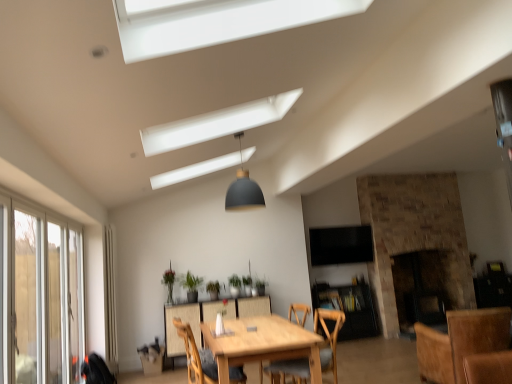
Question: From the image's perspective, is light brown wooden table at center positioned above or below green matte plant at center, placed as the third plant when sorted from right to left?

Choices:
 (A) below
 (B) above

Answer: (A)

Question: In terms of height, does light brown wooden table at center look taller or shorter compared to green matte plant at center, placed as the third plant when sorted from right to left?

Choices:
 (A) tall
 (B) short

Answer: (A)

Question: Which object is positioned closest to the brown wooden chair at lower right, which is counted as the first chair, starting from the right?

Choices:
 (A) light brown wooden table at center
 (B) matte gray dome at center
 (C) green matte plant at center, placed as the third plant when sorted from right to left
 (D) green matte plant at center, acting as the fourth plant starting from the right
 (E) green matte plant at center, the second plant positioned from the right

Answer: (A)

Question: Which of these objects is positioned closest to the black glossy tv at upper center?

Choices:
 (A) clear glass screen door at left
 (B) green matte plant at center, marked as the second plant in a left-to-right arrangement
 (C) matte gray dome at center
 (D) light brown wooden table at center
 (E) wooden chair at center, the third chair positioned from the right

Answer: (B)